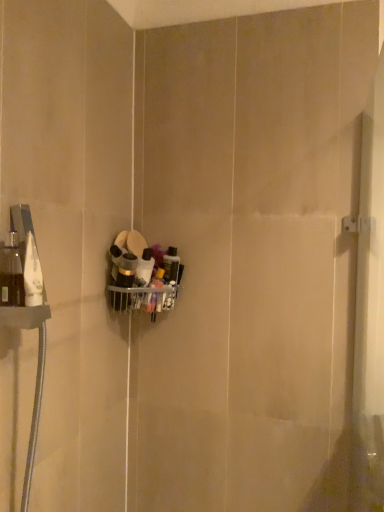
Question: From the image's perspective, is translucent plastic bottles at center, the second toiletry when ordered from left to right, located above matte black container at center, the first toiletry when ordered from left to right?

Choices:
 (A) yes
 (B) no

Answer: (B)

Question: Is the position of translucent plastic bottles at center, the second toiletry when ordered from left to right, more distant than that of matte black container at center, which ranks as the 2th toiletry in right-to-left order?

Choices:
 (A) no
 (B) yes

Answer: (B)

Question: Considering the relative sizes of translucent plastic bottles at center, acting as the 1th toiletry starting from the right, and matte black container at center, which ranks as the 2th toiletry in right-to-left order, in the image provided, is translucent plastic bottles at center, acting as the 1th toiletry starting from the right, smaller than matte black container at center, which ranks as the 2th toiletry in right-to-left order,?

Choices:
 (A) no
 (B) yes

Answer: (B)

Question: Are translucent plastic bottles at center, the second toiletry when ordered from left to right, and matte black container at center, the first toiletry when ordered from left to right, located far from each other?

Choices:
 (A) no
 (B) yes

Answer: (A)

Question: Does translucent plastic bottles at center, the second toiletry when ordered from left to right, have a lesser width compared to matte black container at center, the first toiletry when ordered from left to right?

Choices:
 (A) no
 (B) yes

Answer: (B)

Question: Considering the relative sizes of translucent plastic bottles at center, the second toiletry when ordered from left to right, and matte black container at center, the first toiletry when ordered from left to right, in the image provided, is translucent plastic bottles at center, the second toiletry when ordered from left to right, bigger than matte black container at center, the first toiletry when ordered from left to right,?

Choices:
 (A) yes
 (B) no

Answer: (B)

Question: Is matte black container at center, the first toiletry when ordered from left to right, positioned beyond the bounds of translucent plastic bottles at center, the second toiletry when ordered from left to right?

Choices:
 (A) yes
 (B) no

Answer: (A)

Question: From the image's perspective, is matte black container at center, the first toiletry when ordered from left to right, above translucent plastic bottles at center, acting as the 1th toiletry starting from the right?

Choices:
 (A) no
 (B) yes

Answer: (B)

Question: Can you confirm if matte black container at center, the first toiletry when ordered from left to right, is smaller than translucent plastic bottles at center, the second toiletry when ordered from left to right?

Choices:
 (A) yes
 (B) no

Answer: (B)

Question: Does matte black container at center, which ranks as the 2th toiletry in right-to-left order, turn towards translucent plastic bottles at center, acting as the 1th toiletry starting from the right?

Choices:
 (A) no
 (B) yes

Answer: (A)

Question: Is matte black container at center, which ranks as the 2th toiletry in right-to-left order, facing away from translucent plastic bottles at center, the second toiletry when ordered from left to right?

Choices:
 (A) no
 (B) yes

Answer: (A)

Question: From a real-world perspective, is matte black container at center, the first toiletry when ordered from left to right, positioned over translucent plastic bottles at center, acting as the 1th toiletry starting from the right, based on gravity?

Choices:
 (A) yes
 (B) no

Answer: (A)

Question: Is translucent plastic bottles at center, acting as the 1th toiletry starting from the right, spatially inside matte black container at center, which ranks as the 2th toiletry in right-to-left order, or outside of it?

Choices:
 (A) outside
 (B) inside

Answer: (A)